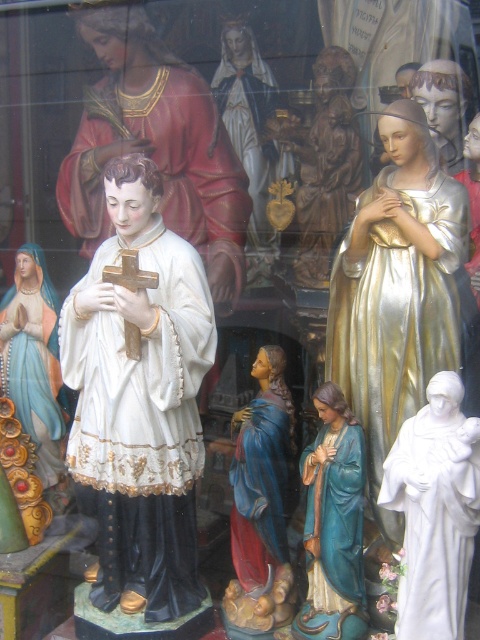
You are a customer in a religious shop and see the wooden statue at center and the gold leaf statue at center. Which one is more to the right?

The wooden statue at center is more to the right.

You are a customer looking at the shop window. You see the blue glossy statue at lower center and the matte gold statue at center. Which statue can you see more clearly from your current position?

The blue glossy statue at lower center is closer to the viewer than the matte gold statue at center, so you can see it more clearly from your current position.

What is the size relationship between the wooden statue at center and the gold leaf statue at center in the shop window?

The wooden statue at center is smaller than the gold leaf statue at center.